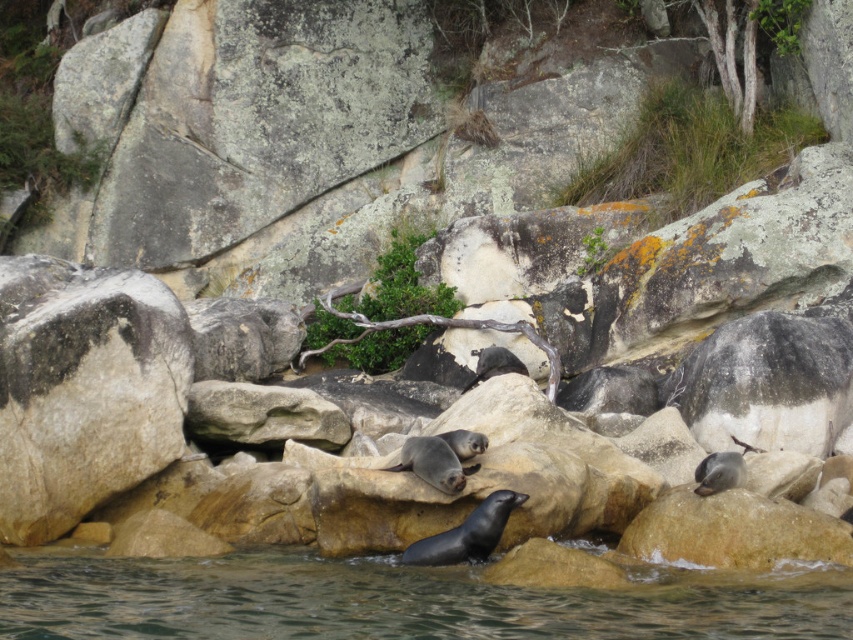
Question: Does clear water at lower center have a smaller size compared to gray rough rock at left?

Choices:
 (A) yes
 (B) no

Answer: (A)

Question: Which point is closer to the camera taking this photo?

Choices:
 (A) (55, 572)
 (B) (15, 323)

Answer: (A)

Question: Can you confirm if clear water at lower center is smaller than gray rough rock at left?

Choices:
 (A) yes
 (B) no

Answer: (A)

Question: Among these objects, which one is farthest from the camera?

Choices:
 (A) gray rough rock at left
 (B) clear water at lower center

Answer: (A)

Question: Is clear water at lower center to the left of gray rough rock at left from the viewer's perspective?

Choices:
 (A) no
 (B) yes

Answer: (A)

Question: Which of the following is the farthest from the observer?

Choices:
 (A) clear water at lower center
 (B) gray rough rock at left

Answer: (B)